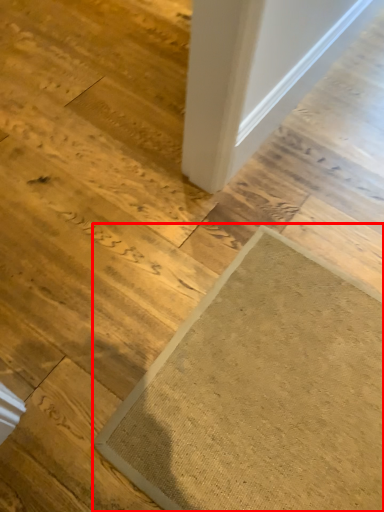
Question: From the image, what is the correct spatial relationship of mat (annotated by the red box) in relation to door?

Choices:
 (A) left
 (B) right

Answer: (A)